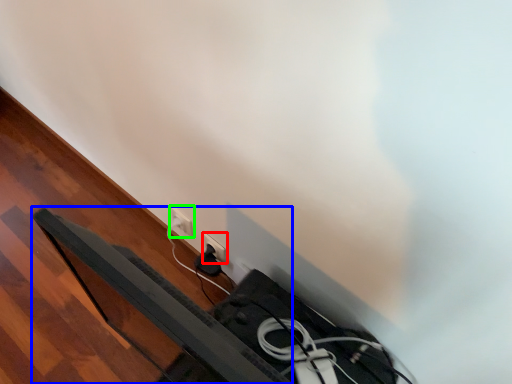
Question: Which is nearer to the power plugs and sockets (highlighted by a red box)? bed frame (highlighted by a blue box) or power plugs and sockets (highlighted by a green box).

Choices:
 (A) bed frame
 (B) power plugs and sockets

Answer: (B)